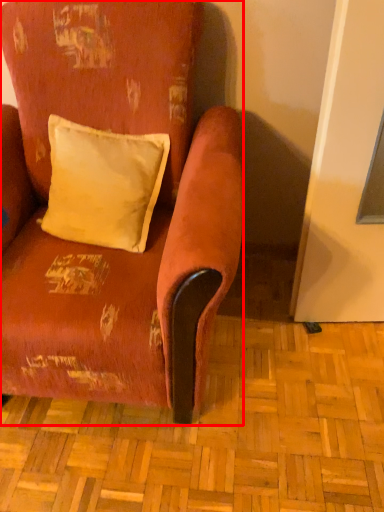
Question: Considering the relative positions of chair (annotated by the red box) and pillow in the image provided, where is chair (annotated by the red box) located with respect to the staircase?

Choices:
 (A) right
 (B) left

Answer: (B)